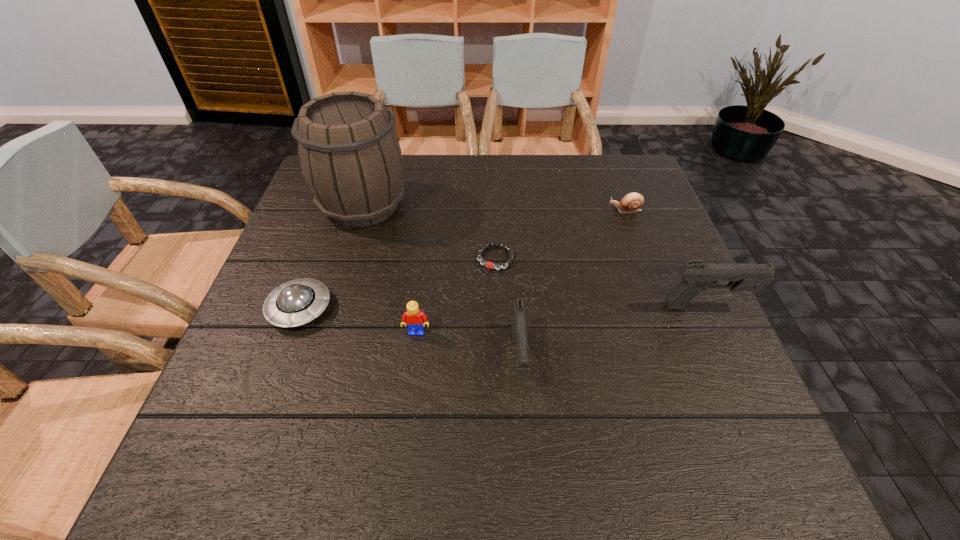
You are a GUI agent. You are given a task and a screenshot of the screen. Output one action in this format:
    pyautogui.click(x=<x>, y=<y>)
    Task: Click on the left pistol
    This screenshot has height=540, width=960.
    Given the screenshot: What is the action you would take?
    pyautogui.click(x=519, y=330)

At what (x,y) coordinates should I click in order to perform the action: click on the nearer pistol. Please return your answer as a coordinate pair (x, y). Image resolution: width=960 pixels, height=540 pixels. Looking at the image, I should click on (519, 330).

The image size is (960, 540). In order to click on the farther pistol in this screenshot , I will do `click(696, 277)`.

This screenshot has height=540, width=960. Find the location of `the sixth shortest object`. the sixth shortest object is located at coordinates click(x=696, y=277).

Find the location of a particular element. the shortest object is located at coordinates (490, 265).

The image size is (960, 540). I want to click on the fifth nearest object, so click(x=490, y=265).

This screenshot has height=540, width=960. I want to click on wine bucket, so click(x=349, y=153).

The image size is (960, 540). Identify the location of escargot. (633, 201).

This screenshot has width=960, height=540. I want to click on saucer, so click(297, 302).

Where is `Lego`? Image resolution: width=960 pixels, height=540 pixels. Lego is located at coordinates (414, 318).